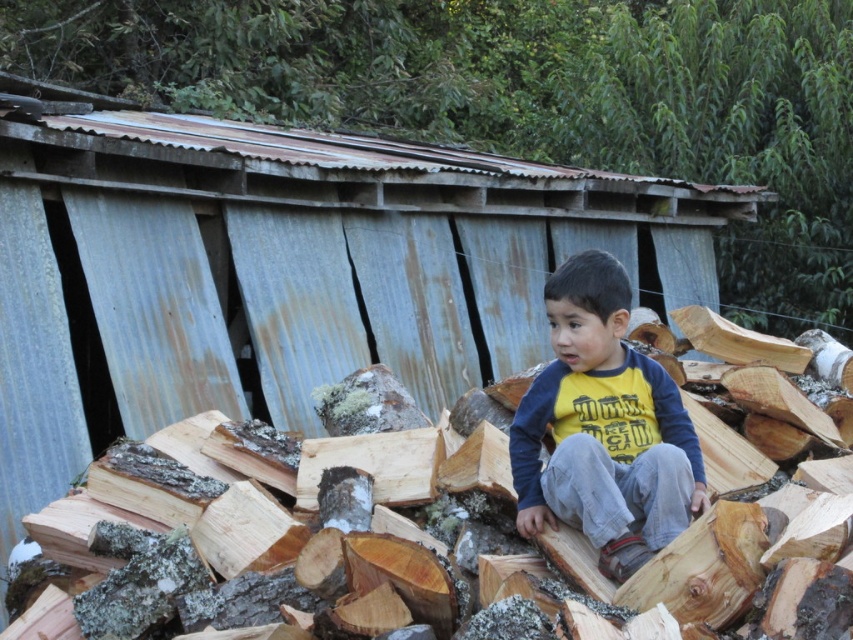
Question: Considering the relative positions of brown rough wood at center and yellow cotton shirt at center in the image provided, where is brown rough wood at center located with respect to yellow cotton shirt at center?

Choices:
 (A) below
 (B) above

Answer: (A)

Question: Can you confirm if brown rough wood at center is wider than yellow cotton shirt at center?

Choices:
 (A) yes
 (B) no

Answer: (A)

Question: Is brown rough wood at center further to the viewer compared to yellow cotton shirt at center?

Choices:
 (A) no
 (B) yes

Answer: (A)